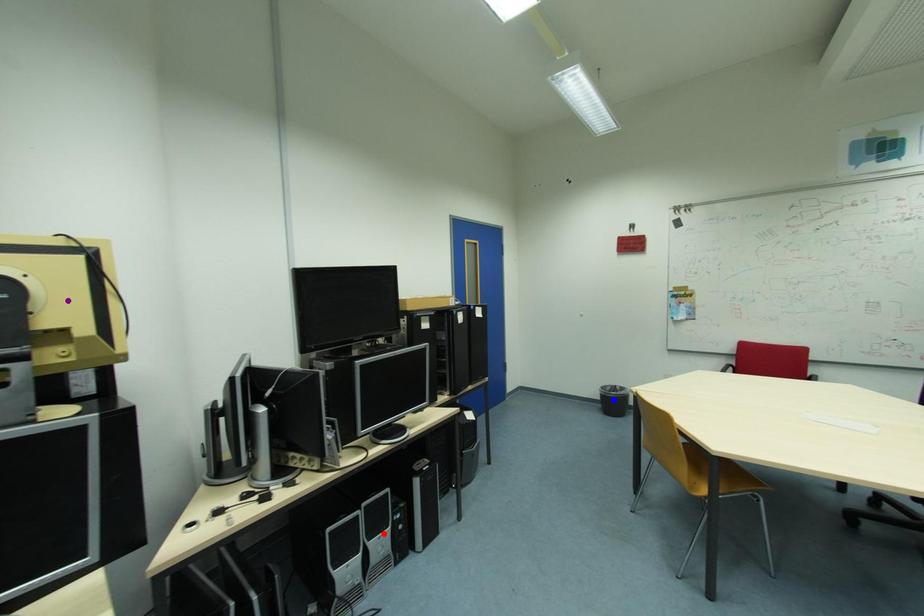
Order these from farthest to nearest:
blue point
red point
purple point

blue point
red point
purple point